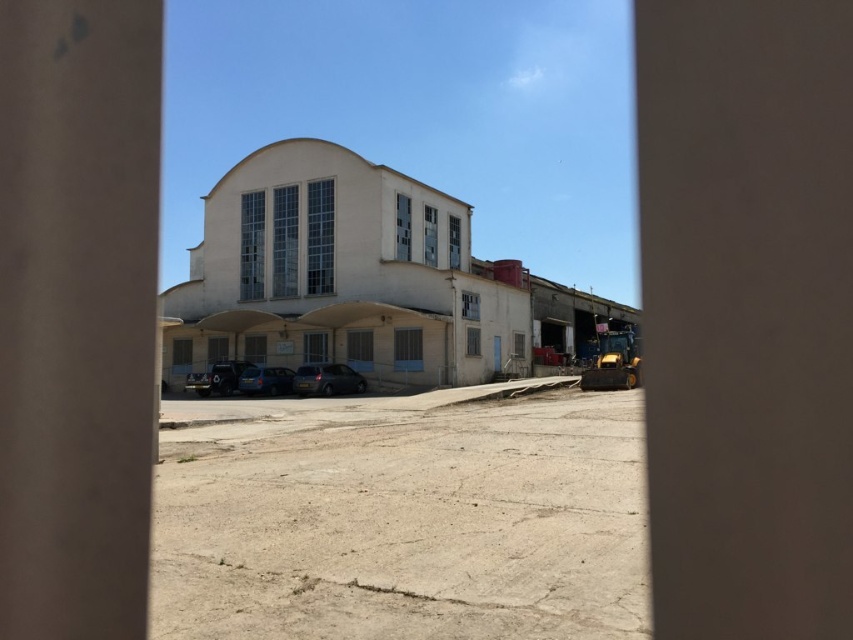
Question: Which point appears closest to the camera in this image?

Choices:
 (A) (x=281, y=390)
 (B) (x=218, y=369)
 (C) (x=321, y=385)
 (D) (x=96, y=426)

Answer: (D)

Question: Which of the following is the closest to the observer?

Choices:
 (A) (218, 372)
 (B) (264, 385)

Answer: (B)

Question: Is smooth concrete pillar at center above shiny black car at center?

Choices:
 (A) no
 (B) yes

Answer: (B)

Question: Is shiny black car at center wider than matte blue van at center?

Choices:
 (A) no
 (B) yes

Answer: (A)

Question: Which point is closer to the camera taking this photo?

Choices:
 (A) (258, 371)
 (B) (67, 100)
 (C) (210, 380)
 (D) (334, 381)

Answer: (B)

Question: Is the position of satin black car at center more distant than that of shiny black car at center?

Choices:
 (A) no
 (B) yes

Answer: (A)